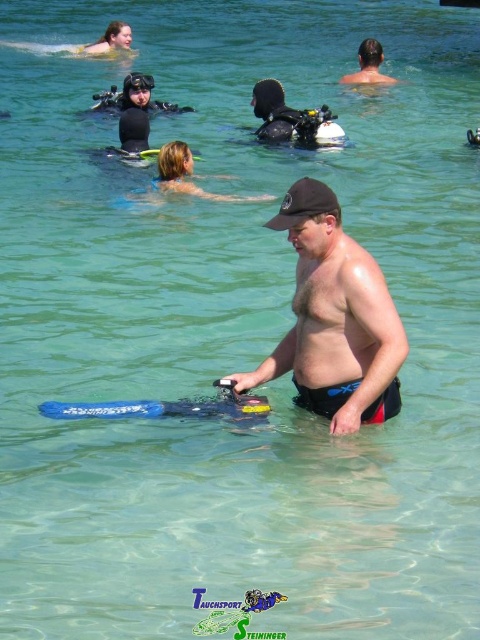
You are a scuba diving instructor observing the scene. You need to check if the matte black cap at center is positioned in front of the black matte snorkel mask at upper center. Can you confirm this?

Yes, the matte black cap at center is closer to the viewer than the black matte snorkel mask at upper center, so it is positioned in front of it.

You are a safety diver who needs to reach the black matte snorkel mask at upper center from the black matte scuba gear at center. Given that your maximum safe diving distance without a surface support is 4 meters, can you safely reach the mask without needing additional support?

The distance between the black matte scuba gear at center and the black matte snorkel mask at upper center is 4.22 meters. Since your maximum safe diving distance is 4 meters, you would need additional surface support to safely reach the mask.

You are a scuba diving instructor observing the scene. You notice a point at coordinates [291,120]. Which object in the scene is this point located on?

The point at coordinates [291,120] is located on the black matte scuba gear at center.